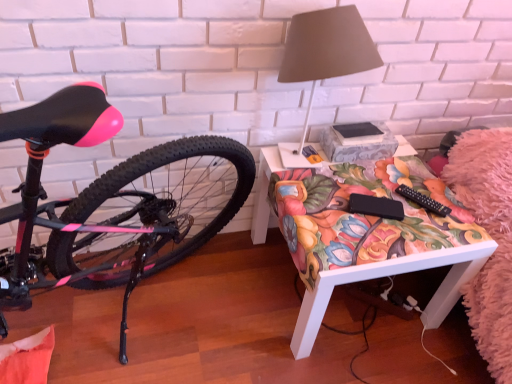
Locate an element on the screen. blank space situated above floral fabric desk at center (from a real-world perspective) is located at coordinates (367, 192).